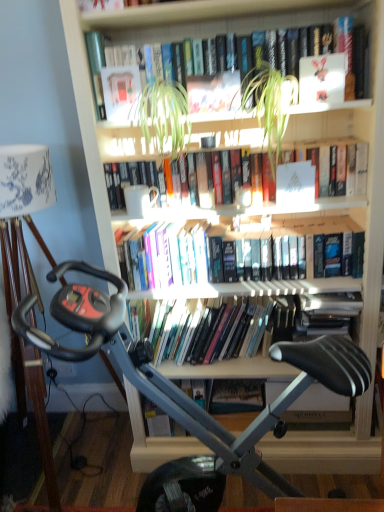
Where is `hardcover book at upper center, the fourth book from the bottom`? This screenshot has width=384, height=512. hardcover book at upper center, the fourth book from the bottom is located at coordinates (249, 35).

Measure the distance between green leafy plant at upper center, positioned as the second plant in left-to-right order, and camera.

green leafy plant at upper center, positioned as the second plant in left-to-right order, is 1.34 meters away from camera.

You are a GUI agent. You are given a task and a screenshot of the screen. Output one action in this format:
    pyautogui.click(x=<x>, y=<y>)
    Task: Click on the hardcover books at center, acting as the 2th book starting from the top
    The width and height of the screenshot is (384, 512).
    Given the screenshot: What is the action you would take?
    pyautogui.click(x=128, y=189)

What do you see at coordinates (256, 417) in the screenshot? I see `silver metallic stationary bicycle at center` at bounding box center [256, 417].

In order to face silver metallic stationary bicycle at center, should I rotate leftwards or rightwards?

To face it directly, rotate right by 1.928 degrees.

In the scene shown: What is the approximate width of matte paper paperback at center, the 1th paperback book positioned from the back?

It is 9.66 centimeters.

Measure the distance between point [119,109] and camera.

They are 1.44 meters apart.

What do you see at coordinates (295, 184) in the screenshot? The width and height of the screenshot is (384, 512). I see `white matte paper at center, which is the 2th paperback book from front to back` at bounding box center [295, 184].

You are a GUI agent. You are given a task and a screenshot of the screen. Output one action in this format:
    pyautogui.click(x=<x>, y=<y>)
    Task: Click on the hardcover book at upper center, the fourth book from the bottom
    Image resolution: width=384 pixels, height=512 pixels.
    Given the screenshot: What is the action you would take?
    pyautogui.click(x=249, y=35)

Considering the sizes of hardcover book at center, acting as the 1th book starting from the bottom, and white matte book at upper center, the first paperback book from the right, in the image, is hardcover book at center, acting as the 1th book starting from the bottom, wider or thinner than white matte book at upper center, the first paperback book from the right,?

In the image, hardcover book at center, acting as the 1th book starting from the bottom, appears to be wider than white matte book at upper center, the first paperback book from the right.

Is hardcover book at center, acting as the 1th book starting from the bottom, to the right of white matte book at upper center, the first paperback book from the right, from the viewer's perspective?

Incorrect, hardcover book at center, acting as the 1th book starting from the bottom, is not on the right side of white matte book at upper center, the first paperback book from the right.

Which object is closer to the camera, hardcover book at center, the 4th book when ordered from top to bottom, or white matte book at upper center, which is the first paperback book in front-to-back order?

white matte book at upper center, which is the first paperback book in front-to-back order, is in front.

Is hardcover book at center, acting as the 1th book starting from the bottom, looking in the opposite direction of white matte book at upper center, the first paperback book from the right?

No, white matte book at upper center, the first paperback book from the right, is not at the back of hardcover book at center, acting as the 1th book starting from the bottom.

Is white matte paper at center, which appears as the second paperback book when viewed from the right, facing towards white matte book at upper center, the 1th paperback book viewed from the top?

No, white matte paper at center, which appears as the second paperback book when viewed from the right, is not facing towards white matte book at upper center, the 1th paperback book viewed from the top.

Is white matte paper at center, which is the third paperback book from back to front, positioned far away from white matte book at upper center, the 1th paperback book viewed from the top?

They are positioned close to each other.

Does white matte paper at center, which is the third paperback book from back to front, appear on the right side of white matte book at upper center, the fourth paperback book from the bottom?

No, white matte paper at center, which is the third paperback book from back to front, is not to the right of white matte book at upper center, the fourth paperback book from the bottom.

Which object is further away from the camera, white matte paper at center, marked as the third paperback book in a top-to-bottom arrangement, or white matte book at upper center, the first paperback book from the right?

white matte paper at center, marked as the third paperback book in a top-to-bottom arrangement, is more distant.

Identify the location of stationary bicycle on the left of matte paper paperback at center, the 1th paperback book positioned from the back. Image resolution: width=384 pixels, height=512 pixels. (256, 417).

From their relative heights in the image, would you say silver metallic stationary bicycle at center is taller or shorter than matte paper paperback at center, the 4th paperback book viewed from the front?

In the image, silver metallic stationary bicycle at center appears to be taller than matte paper paperback at center, the 4th paperback book viewed from the front.

Are silver metallic stationary bicycle at center and matte paper paperback at center, the 1th paperback book positioned from the back, located far from each other?

silver metallic stationary bicycle at center is near matte paper paperback at center, the 1th paperback book positioned from the back, not far away.

Which point is more forward, (x=164, y=398) or (x=254, y=410)?

The point (x=164, y=398) is closer to the camera.

From the image's perspective, which object appears higher, white matte book at upper center, acting as the fourth paperback book starting from the left, or white matte paper at center, marked as the third paperback book in a top-to-bottom arrangement?

white matte book at upper center, acting as the fourth paperback book starting from the left, appears higher in the image.

Is the position of white matte book at upper center, acting as the fourth paperback book starting from the left, less distant than that of white matte paper at center, the 3th paperback book positioned from the left?

Yes, it is in front of white matte paper at center, the 3th paperback book positioned from the left.

Between white matte book at upper center, the first paperback book from the right, and white matte paper at center, marked as the third paperback book in a top-to-bottom arrangement, which one appears on the left side from the viewer's perspective?

From the viewer's perspective, white matte paper at center, marked as the third paperback book in a top-to-bottom arrangement, appears more on the left side.

From a real-world perspective, is white matte book at upper center, which is the first paperback book in front-to-back order, on top of white matte paper at center, the 3th paperback book positioned from the left?

Yes, from a real-world perspective, white matte book at upper center, which is the first paperback book in front-to-back order, is above white matte paper at center, the 3th paperback book positioned from the left.

Does silver metallic stationary bicycle at center appear on the right side of hardcover books at center, acting as the 2th book starting from the top?

Incorrect, silver metallic stationary bicycle at center is not on the right side of hardcover books at center, acting as the 2th book starting from the top.

Between point (109, 341) and point (250, 191), which one is positioned behind?

The point (250, 191) is farther from the camera.

From the image's perspective, which one is positioned lower, silver metallic stationary bicycle at center or hardcover books at center, which is the 3th book from bottom to top?

From the image's view, silver metallic stationary bicycle at center is below.

Which of these two, silver metallic stationary bicycle at center or hardcover books at center, acting as the 2th book starting from the top, is thinner?

Thinner between the two is hardcover books at center, acting as the 2th book starting from the top.

Identify the location of paperback book on the left of the hardcover books at center, marked as the 3th book in a top-to-bottom arrangement. The image size is (384, 512). (121, 93).

Is hardcover books at center, marked as the 3th book in a top-to-bottom arrangement, shorter than matte paper book at upper center, the 4th paperback book from the right?

In fact, hardcover books at center, marked as the 3th book in a top-to-bottom arrangement, may be taller than matte paper book at upper center, the 4th paperback book from the right.

Would you say matte paper book at upper center, arranged as the 3th paperback book when ordered from the bottom, is part of hardcover books at center, marked as the 3th book in a top-to-bottom arrangement,'s contents?

No, hardcover books at center, marked as the 3th book in a top-to-bottom arrangement, does not contain matte paper book at upper center, arranged as the 3th paperback book when ordered from the bottom.

Does white matte book at upper center, the 1th paperback book viewed from the top, turn towards green leafy plant at center, positioned as the first plant in left-to-right order?

No, white matte book at upper center, the 1th paperback book viewed from the top, is not turned towards green leafy plant at center, positioned as the first plant in left-to-right order.

Who is smaller, white matte book at upper center, the fourth paperback book from the bottom, or green leafy plant at center, the 2th plant viewed from the right?

white matte book at upper center, the fourth paperback book from the bottom.

How far apart are white matte book at upper center, the 1th paperback book viewed from the top, and green leafy plant at center, positioned as the first plant in left-to-right order?

They are 17.71 inches apart.

From a real-world perspective, between white matte book at upper center, the 1th paperback book viewed from the top, and green leafy plant at center, positioned as the first plant in left-to-right order, who is vertically higher?

white matte book at upper center, the 1th paperback book viewed from the top, is physically above.

The image size is (384, 512). I want to click on the 3rd paperback book counting from the right of the hardcover book at center, the 4th book when ordered from top to bottom, so click(x=322, y=79).

Locate an element on the screen. The image size is (384, 512). the 2nd paperback book above the white matte paper at center, marked as the second paperback book in a bottom-to-top arrangement (from the image's perspective) is located at coordinates (322, 79).

Which object lies further to the anchor point hardcover book at center, the 4th book when ordered from top to bottom, hardcover books at center, which is the 3th book from bottom to top, or green leafy plant at upper center, arranged as the 1th plant when viewed from the right?

green leafy plant at upper center, arranged as the 1th plant when viewed from the right, is further to hardcover book at center, the 4th book when ordered from top to bottom.

From the image, which object appears to be nearer to hardcover books at center, the 2th book ordered from the bottom, white matte book at upper center, the first paperback book from the right, or hardcover books at center, which is the 3th book from bottom to top?

hardcover books at center, which is the 3th book from bottom to top, lies closer to hardcover books at center, the 2th book ordered from the bottom, than the other object.

Based on their spatial positions, is matte paper book at upper center, the third paperback book when ordered from front to back, or green leafy plant at upper center, positioned as the second plant in left-to-right order, closer to green leafy plant at center, the 2th plant viewed from the right?

Based on the image, matte paper book at upper center, the third paperback book when ordered from front to back, appears to be nearer to green leafy plant at center, the 2th plant viewed from the right.

In the scene shown: From the image, which object appears to be nearer to white matte book at upper center, the fourth paperback book from the bottom, green leafy plant at center, the 2th plant viewed from the right, or hardcover book at upper center, which is counted as the first book, starting from the top?

hardcover book at upper center, which is counted as the first book, starting from the top, is positioned closer to the anchor white matte book at upper center, the fourth paperback book from the bottom.

Based on their spatial positions, is white matte paper at center, the 3th paperback book positioned from the left, or green leafy plant at upper center, positioned as the second plant in left-to-right order, closer to matte paper paperback at center, positioned as the second paperback book in left-to-right order?

Among the two, white matte paper at center, the 3th paperback book positioned from the left, is located nearer to matte paper paperback at center, positioned as the second paperback book in left-to-right order.

From the image, which object appears to be nearer to hardcover book at upper center, the fourth book from the bottom, green leafy plant at center, positioned as the first plant in left-to-right order, or white matte paper at center, marked as the third paperback book in a top-to-bottom arrangement?

The object closer to hardcover book at upper center, the fourth book from the bottom, is green leafy plant at center, positioned as the first plant in left-to-right order.

From the image, which object appears to be farther from silver metallic stationary bicycle at center, hardcover book at center, the 4th book when ordered from top to bottom, or white matte book at upper center, which is the first paperback book in front-to-back order?

white matte book at upper center, which is the first paperback book in front-to-back order, is further to silver metallic stationary bicycle at center.

Considering their positions, is matte paper paperback at center, the 1th paperback book positioned from the back, positioned further to hardcover books at center, acting as the 2th book starting from the top, than white matte paper at center, marked as the second paperback book in a bottom-to-top arrangement?

matte paper paperback at center, the 1th paperback book positioned from the back, lies further to hardcover books at center, acting as the 2th book starting from the top, than the other object.

Where is `plant situated between green leafy plant at center, positioned as the first plant in left-to-right order, and white matte book at upper center, the 1th paperback book viewed from the top, from left to right`? This screenshot has height=512, width=384. plant situated between green leafy plant at center, positioned as the first plant in left-to-right order, and white matte book at upper center, the 1th paperback book viewed from the top, from left to right is located at coordinates (271, 105).

This screenshot has width=384, height=512. I want to click on paperback book between green leafy plant at center, the 2th plant viewed from the right, and matte paper paperback at center, arranged as the first paperback book when ordered from the bottom, in the up-down direction, so click(295, 184).

Where is `paperback book that lies between hardcover books at center, acting as the 2th book starting from the top, and silver metallic stationary bicycle at center from top to bottom`? paperback book that lies between hardcover books at center, acting as the 2th book starting from the top, and silver metallic stationary bicycle at center from top to bottom is located at coordinates pyautogui.click(x=295, y=184).

Find the location of a particular element. The width and height of the screenshot is (384, 512). book between white matte book at upper center, acting as the fourth paperback book starting from the left, and white matte paper at center, which appears as the second paperback book when viewed from the right, in the up-down direction is located at coordinates (128, 189).